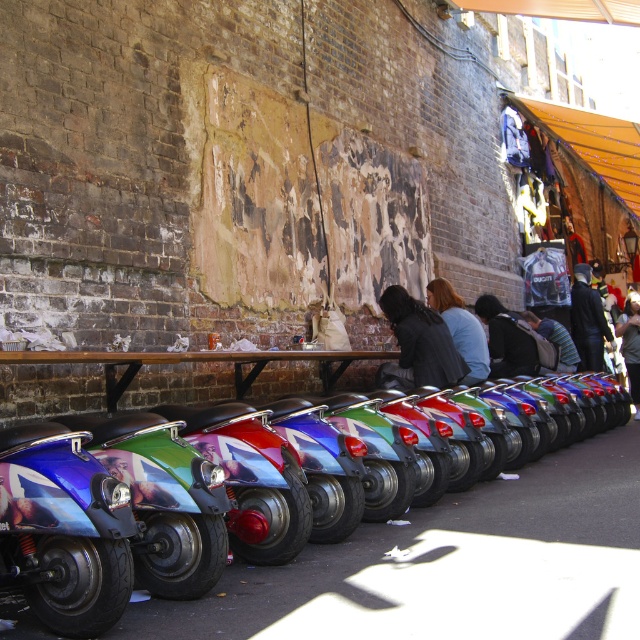
Question: Which is nearer to the shiny metallic scooter at lower left?

Choices:
 (A) dark gray sweater at center
 (B) dark gray hoodie at center
 (C) dark blue leather jacket at center
 (D) metallic multi-colored scooter at center

Answer: (D)

Question: Does dark gray hoodie at center have a larger size compared to dark gray sweater at center?

Choices:
 (A) no
 (B) yes

Answer: (A)

Question: Which of the following is the closest to the observer?

Choices:
 (A) (93, 636)
 (B) (582, 285)
 (C) (496, 312)

Answer: (A)

Question: Which point is farther from the camera taking this photo?

Choices:
 (A) (580, 307)
 (B) (632, 308)
 (C) (432, 342)
 (D) (456, 310)

Answer: (B)

Question: Does dark gray hoodie at center appear under black leather jacket at center?

Choices:
 (A) yes
 (B) no

Answer: (A)

Question: Is black leather jacket at center thinner than blue fabric jacket at center?

Choices:
 (A) yes
 (B) no

Answer: (B)